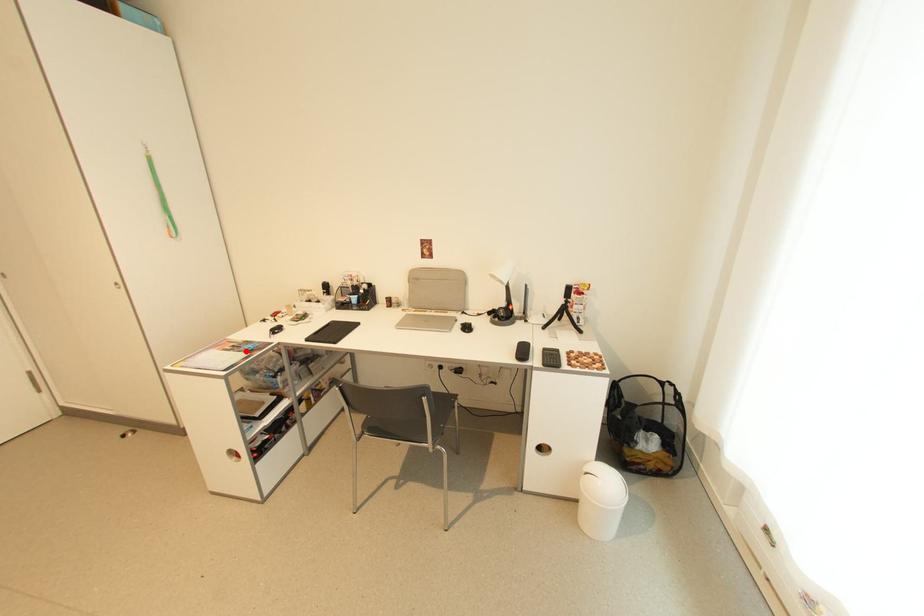
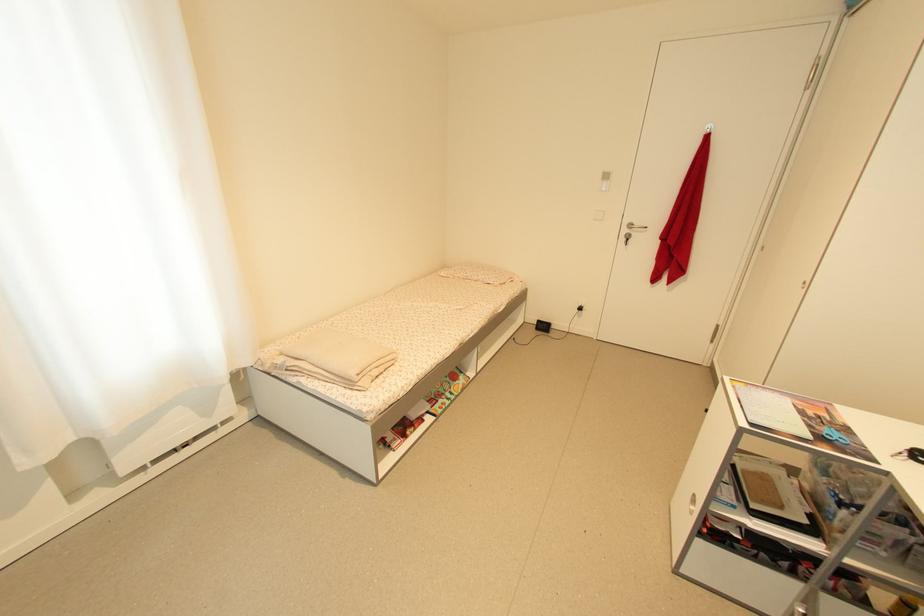
Where in the second image is the point corresponding to the highlighted location from the first image?

(822, 429)